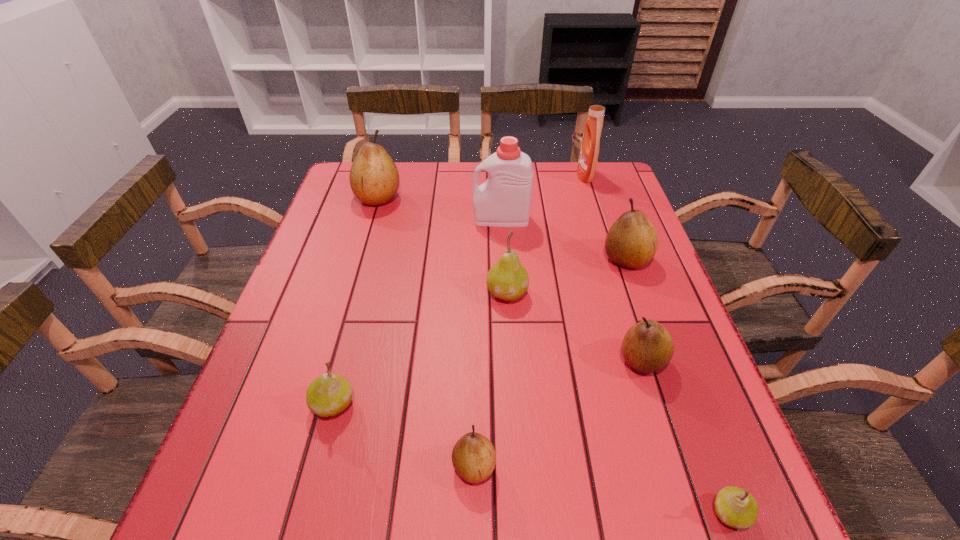
Select which object appears as the fourth closest to the left detergent. Please provide its 2D coordinates. Your answer should be formatted as a tuple, i.e. [(x, y)], where the tuple contains the x and y coordinates of a point satisfying the conditions above.

[(374, 179)]

Identify which pear is the third closest to the nearer detergent. Please provide its 2D coordinates. Your answer should be formatted as a tuple, i.e. [(x, y)], where the tuple contains the x and y coordinates of a point satisfying the conditions above.

[(374, 179)]

The image size is (960, 540). Identify the location of pear that stands as the fourth closest to the farthest brown pear. (647, 347).

This screenshot has height=540, width=960. I want to click on the third closest brown pear to the second farthest pear, so (374, 179).

Locate which brown pear ranks second in proximity to the third nearest object. Please provide its 2D coordinates. Your answer should be formatted as a tuple, i.e. [(x, y)], where the tuple contains the x and y coordinates of a point satisfying the conditions above.

[(647, 347)]

Locate an element on the screen. The height and width of the screenshot is (540, 960). green pear that is the closest one to the nearest brown pear is located at coordinates (328, 395).

Choose which green pear is the second nearest neighbor to the rightmost green pear. Please provide its 2D coordinates. Your answer should be formatted as a tuple, i.e. [(x, y)], where the tuple contains the x and y coordinates of a point satisfying the conditions above.

[(328, 395)]

Find the location of a particular element. This screenshot has width=960, height=540. free space that satisfies the following two spatial constraints: 1. on the front-facing side of the farther detergent; 2. on the front side of the third brown pear from right to left is located at coordinates (679, 466).

The height and width of the screenshot is (540, 960). Find the location of `vacant space that satisfies the following two spatial constraints: 1. on the handle side of the white detergent; 2. on the left side of the fifth farthest object`. vacant space that satisfies the following two spatial constraints: 1. on the handle side of the white detergent; 2. on the left side of the fifth farthest object is located at coordinates (506, 292).